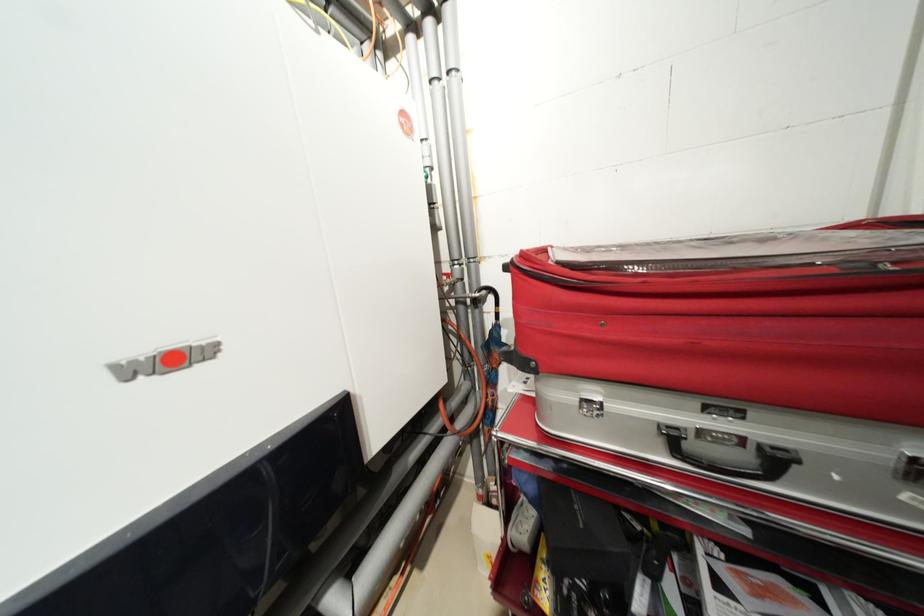
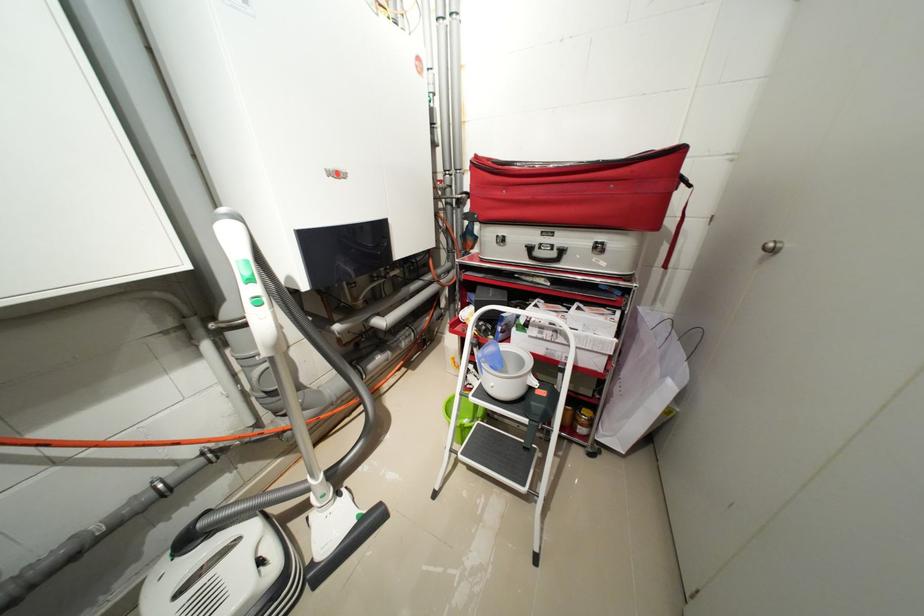
Question: The images are taken continuously from a first-person perspective. In which direction is your viewpoint rotating?

Choices:
 (A) Left
 (B) Right
 (C) Up
 (D) Down

Answer: (D)